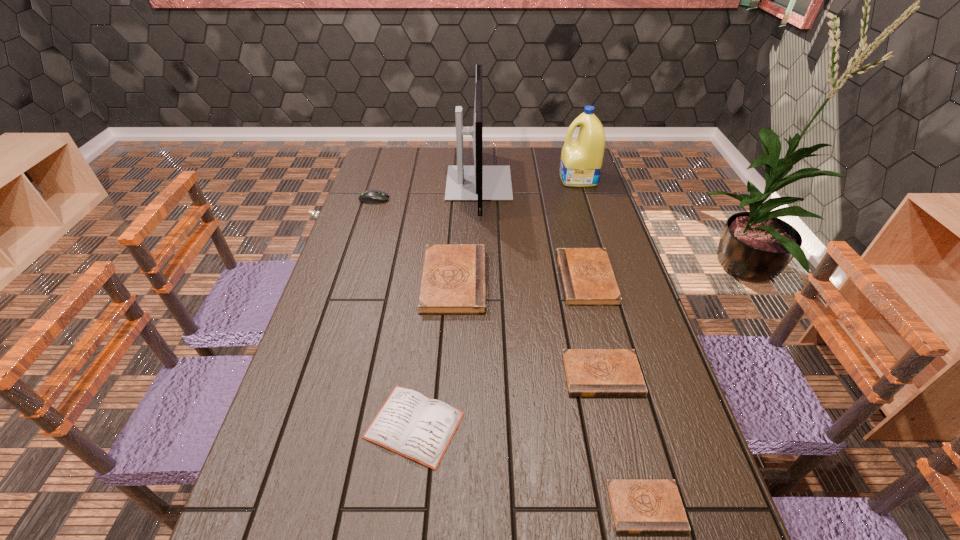
I want to click on computer monitor, so click(x=479, y=183).

Locate an element on the screen. detergent is located at coordinates (581, 159).

Identify the location of the leftmost object. (372, 196).

Identify the location of gray computer mouse. (372, 196).

At what (x,y) coordinates should I click in order to perform the action: click on the tallest diary. Please return your answer as a coordinate pair (x, y). This screenshot has width=960, height=540. Looking at the image, I should click on (453, 282).

This screenshot has height=540, width=960. I want to click on the leftmost brown diary, so click(x=453, y=282).

At what (x,y) coordinates should I click in order to perform the action: click on the fourth shortest diary. Please return your answer as a coordinate pair (x, y). The height and width of the screenshot is (540, 960). Looking at the image, I should click on (587, 278).

You are a GUI agent. You are given a task and a screenshot of the screen. Output one action in this format:
    pyautogui.click(x=<x>, y=<y>)
    Task: Click on the third smallest brown diary
    The height and width of the screenshot is (540, 960).
    Given the screenshot: What is the action you would take?
    pyautogui.click(x=587, y=278)

You are a GUI agent. You are given a task and a screenshot of the screen. Output one action in this format:
    pyautogui.click(x=<x>, y=<y>)
    Task: Click on the sixth tallest object
    The width and height of the screenshot is (960, 540).
    Given the screenshot: What is the action you would take?
    pyautogui.click(x=589, y=372)

Locate an element on the screen. The image size is (960, 540). the second smallest brown diary is located at coordinates (589, 372).